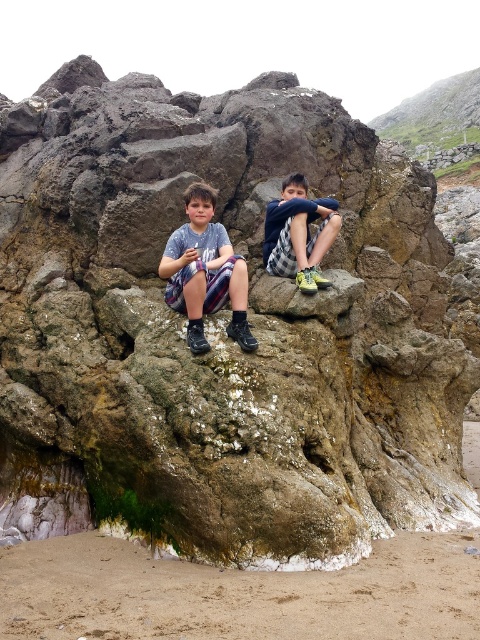
You are a photographer trying to capture a candid shot of both the matte blue shirt at center and the checkered fabric shorts at center. Since the camera can only focus on one subject at a time, which one should you prioritize to ensure the other is still somewhat in focus?

The matte blue shirt at center is in front of the checkered fabric shorts at center, so focusing on the matte blue shirt at center will keep the checkered fabric shorts at center in better focus as they are behind it.

You are standing in front of the rock formation and want to place a small flag at both points. Which point, point (159, 260) or point (295, 212), is closer to you where you can place the flag without needing to move closer?

Point (159, 260) is closer to you than point (295, 212), so you can place the flag there without needing to move closer.

From the picture: You are a photographer trying to capture a candid shot of the two people sitting on the rock. You notice the matte blue shirt at center and the checkered fabric shorts at center. Which object should you focus on to ensure it appears larger in your photo?

The matte blue shirt at center is much taller than the checkered fabric shorts at center, so focusing on the matte blue shirt at center would make it appear larger in the photo.